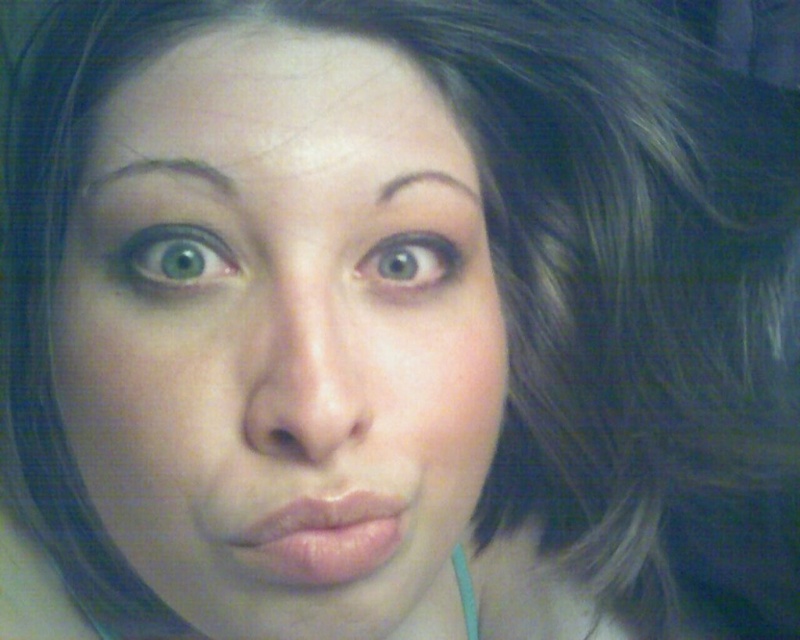
Looking at this image, who is shorter, smooth skin face at center or pink glossy lips at center?

Standing shorter between the two is pink glossy lips at center.

Which is more to the left, smooth skin face at center or pink glossy lips at center?

pink glossy lips at center

Does point (332, 417) lie in front of point (254, 534)?

Yes, it is.

At what (x,y) coordinates should I click in order to perform the action: click on smooth skin face at center. Please return your answer as a coordinate pair (x, y). Looking at the image, I should click on (280, 339).

How far apart are pink glossy lips at center and brown matte eyebrow at upper center?

pink glossy lips at center is 3.94 inches away from brown matte eyebrow at upper center.

Is pink glossy lips at center positioned behind brown matte eyebrow at upper center?

No, pink glossy lips at center is in front of brown matte eyebrow at upper center.

Is point (341, 529) farther from viewer compared to point (428, 172)?

No, (341, 529) is in front of (428, 172).

Locate an element on the screen. pink glossy lips at center is located at coordinates (324, 538).

Is pink glossy lips at center positioned at the back of green matte eye at upper left?

No, pink glossy lips at center is in front of green matte eye at upper left.

Consider the image. Is pink glossy lips at center below green matte eye at upper left?

Yes, pink glossy lips at center is below green matte eye at upper left.

What do you see at coordinates (324, 538) in the screenshot? This screenshot has height=640, width=800. I see `pink glossy lips at center` at bounding box center [324, 538].

Locate an element on the screen. The width and height of the screenshot is (800, 640). pink glossy lips at center is located at coordinates (324, 538).